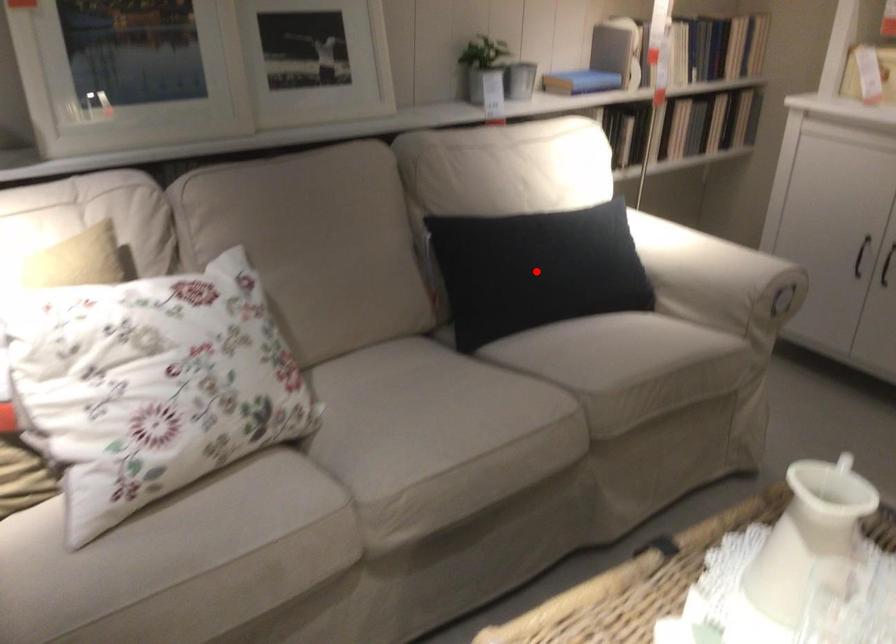
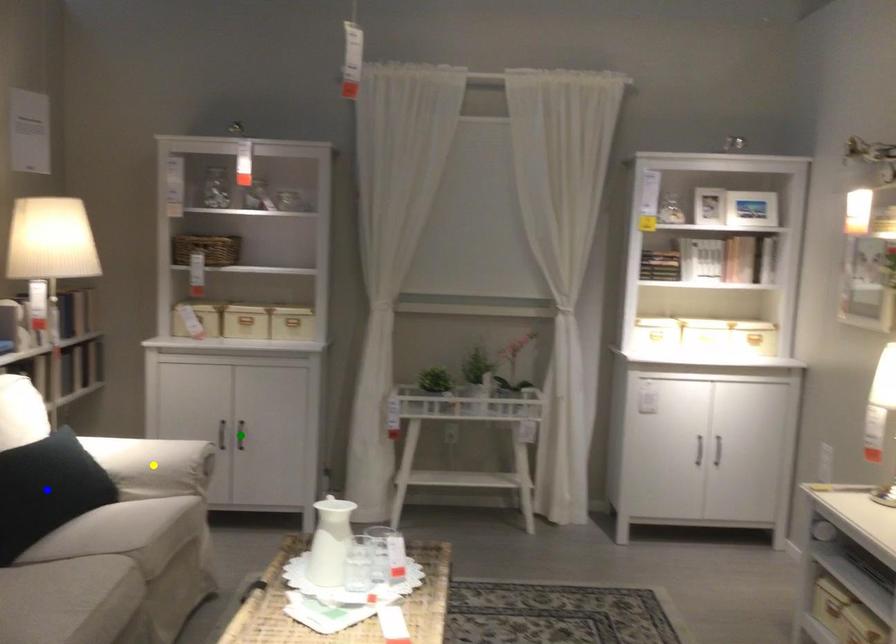
Question: I am providing you with two images of the same scene from different viewpoints. A red point is marked on the first image. You are given multiple points on the second image. Can you choose the point in image 2 that corresponds to the point in image 1?

Choices:
 (A) blue point
 (B) yellow point
 (C) green point

Answer: (A)